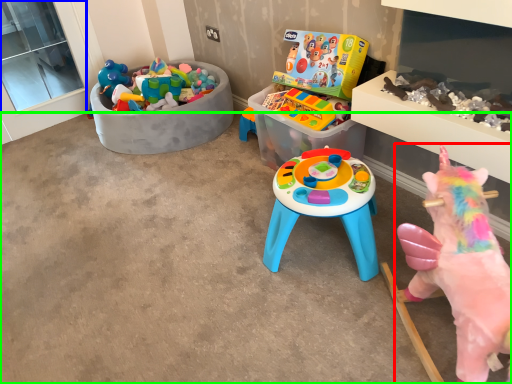
Question: Based on their relative distances, which object is nearer to toy (highlighted by a red box)? Choose from window screen (highlighted by a blue box) and concrete (highlighted by a green box).

Choices:
 (A) window screen
 (B) concrete

Answer: (B)